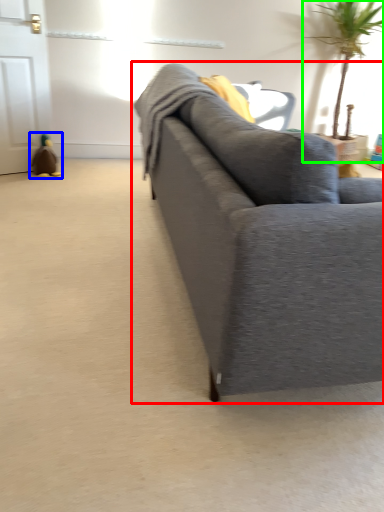
Question: Estimate the real-world distances between objects in this image. Which object is farther from studio couch (highlighted by a red box), toy (highlighted by a blue box) or houseplant (highlighted by a green box)?

Choices:
 (A) toy
 (B) houseplant

Answer: (B)